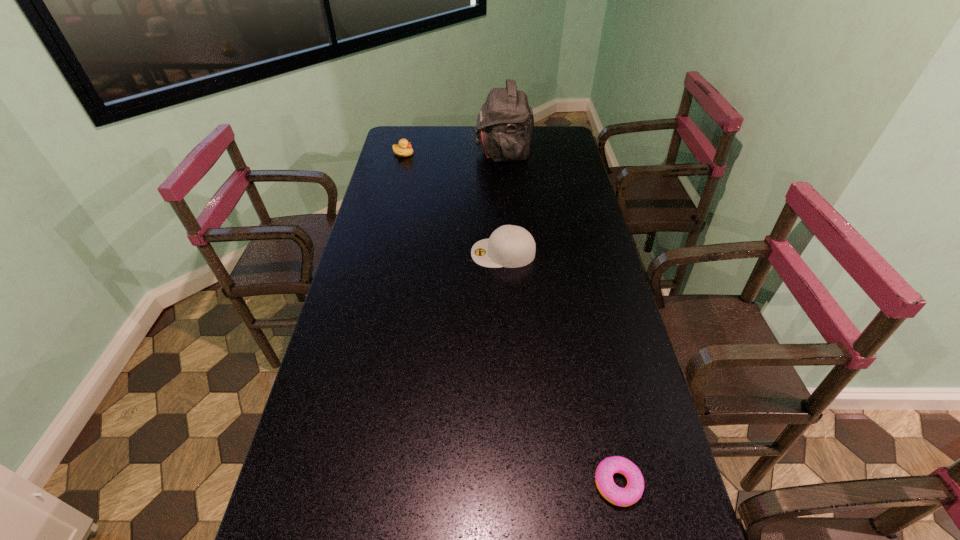
Locate an element on the screen. the tallest object is located at coordinates (505, 124).

Where is `cap`? The height and width of the screenshot is (540, 960). cap is located at coordinates (509, 246).

The width and height of the screenshot is (960, 540). Identify the location of the second tallest object. (509, 246).

At what (x,y) coordinates should I click in order to perform the action: click on the second shortest object. Please return your answer as a coordinate pair (x, y). Looking at the image, I should click on (404, 149).

Locate an element on the screen. The width and height of the screenshot is (960, 540). duckling is located at coordinates (404, 149).

Where is `doughnut`? doughnut is located at coordinates (623, 497).

At what (x,y) coordinates should I click in order to perform the action: click on the shortest object. Please return your answer as a coordinate pair (x, y). The width and height of the screenshot is (960, 540). Looking at the image, I should click on (623, 497).

Where is `free location located 0.210m on the open flap of the shoulder bag`? The height and width of the screenshot is (540, 960). free location located 0.210m on the open flap of the shoulder bag is located at coordinates (427, 152).

This screenshot has width=960, height=540. In order to click on vacant area situated 0.230m on the open flap of the shoulder bag in this screenshot , I will do `click(423, 152)`.

I want to click on vacant space located 0.350m on the open flap of the shoulder bag, so click(396, 152).